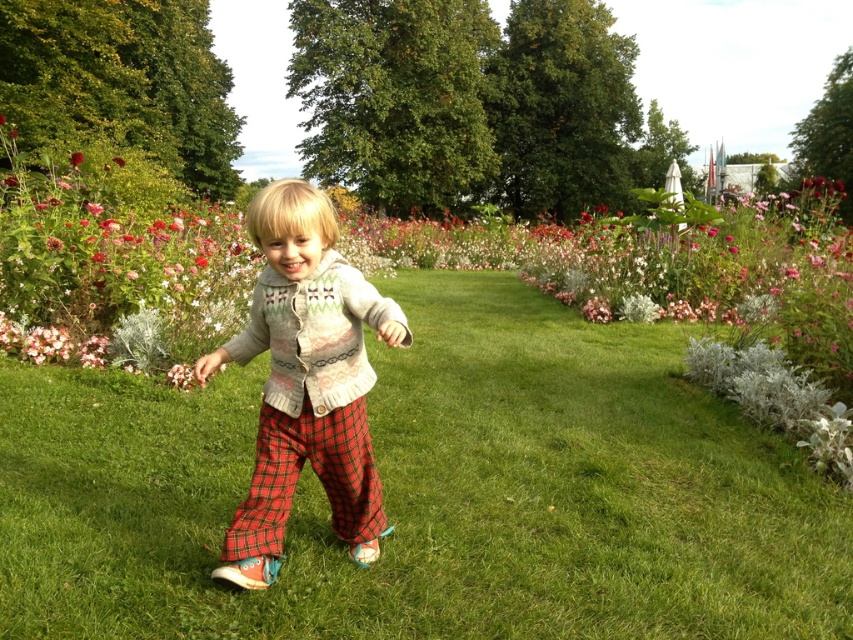
Question: Which is farther from the knitted sweater at center?

Choices:
 (A) pink matte flower at upper left
 (B) green grass at center
 (C) smooth red flower at center
 (D) red plaid pants at center

Answer: (A)

Question: Is knitted sweater at center to the left of pink matte flower at upper left from the viewer's perspective?

Choices:
 (A) yes
 (B) no

Answer: (B)

Question: Can you confirm if knitted sweater at center is positioned below red plaid pants at center?

Choices:
 (A) yes
 (B) no

Answer: (B)

Question: Which point is closer to the camera taking this photo?

Choices:
 (A) (479, 625)
 (B) (291, 464)
 (C) (372, 310)
 (D) (71, 154)

Answer: (C)

Question: Is green grass at center below smooth red flower at center?

Choices:
 (A) no
 (B) yes

Answer: (B)

Question: Which point appears closest to the camera in this image?

Choices:
 (A) (247, 522)
 (B) (660, 406)
 (C) (280, 211)

Answer: (C)